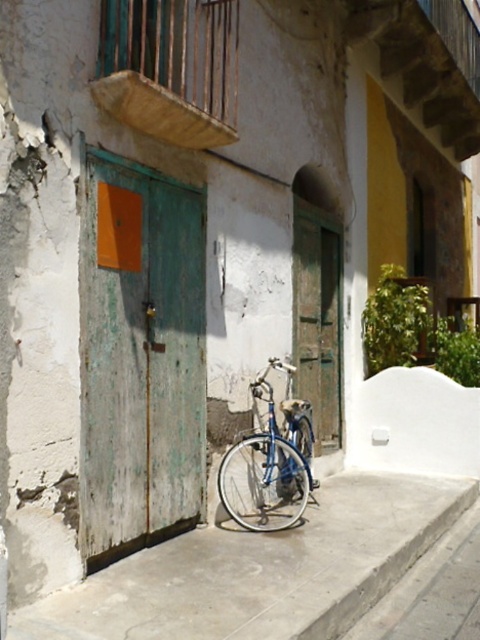
Who is positioned more to the right, smooth concrete pavement at center or green weathered wood door at center?

green weathered wood door at center

Looking at this image, does smooth concrete pavement at center appear on the left side of green weathered wood door at center?

Correct, you'll find smooth concrete pavement at center to the left of green weathered wood door at center.

This screenshot has height=640, width=480. I want to click on smooth concrete pavement at center, so [262, 570].

Does green weathered wood door at left have a greater width compared to green weathered wood door at center?

Yes, green weathered wood door at left is wider than green weathered wood door at center.

This screenshot has width=480, height=640. Identify the location of green weathered wood door at left. point(140,356).

At what (x,y) coordinates should I click in order to perform the action: click on green weathered wood door at left. Please return your answer as a coordinate pair (x, y). Looking at the image, I should click on (140, 356).

Can you confirm if green weathered wood door at left is wider than blue metallic bicycle at center?

No.

Does green weathered wood door at left have a lesser width compared to blue metallic bicycle at center?

Yes.

Describe the element at coordinates (140, 356) in the screenshot. I see `green weathered wood door at left` at that location.

What are the coordinates of `green weathered wood door at left` in the screenshot? It's located at (140, 356).